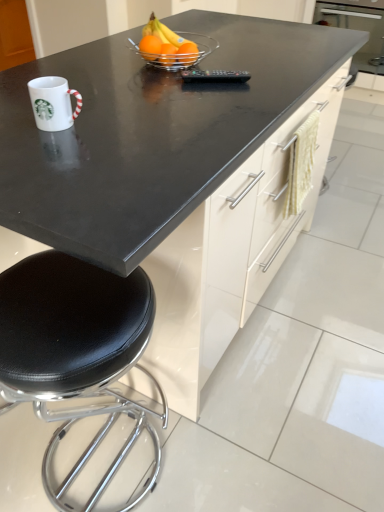
Question: Can you confirm if black glossy countertop at center is positioned to the left of orange matte at center, acting as the third orange starting from the left?

Choices:
 (A) no
 (B) yes

Answer: (B)

Question: Is black glossy countertop at center shorter than orange matte at center, positioned as the 1th orange in right-to-left order?

Choices:
 (A) no
 (B) yes

Answer: (A)

Question: Is black glossy countertop at center oriented away from orange matte at center, positioned as the 1th orange in right-to-left order?

Choices:
 (A) no
 (B) yes

Answer: (A)

Question: Does black glossy countertop at center contain orange matte at center, positioned as the 1th orange in right-to-left order?

Choices:
 (A) yes
 (B) no

Answer: (B)

Question: Is black glossy countertop at center smaller than orange matte at center, positioned as the 1th orange in right-to-left order?

Choices:
 (A) yes
 (B) no

Answer: (B)

Question: Based on their positions, is translucent glass bowl at center located to the left or right of white glossy mug at left?

Choices:
 (A) right
 (B) left

Answer: (A)

Question: From the image's perspective, relative to white glossy mug at left, is translucent glass bowl at center above or below?

Choices:
 (A) above
 (B) below

Answer: (A)

Question: In terms of width, does translucent glass bowl at center look wider or thinner when compared to white glossy mug at left?

Choices:
 (A) thin
 (B) wide

Answer: (B)

Question: Is point (178, 68) positioned closer to the camera than point (62, 129)?

Choices:
 (A) closer
 (B) farther

Answer: (B)

Question: Considering the relative positions of translucent glass bowl at center and black glossy countertop at center in the image provided, is translucent glass bowl at center to the left or to the right of black glossy countertop at center?

Choices:
 (A) right
 (B) left

Answer: (B)

Question: In the image, is translucent glass bowl at center positioned in front of or behind black glossy countertop at center?

Choices:
 (A) behind
 (B) front

Answer: (A)

Question: Considering the positions of point (150, 53) and point (122, 265), is point (150, 53) closer or farther from the camera than point (122, 265)?

Choices:
 (A) farther
 (B) closer

Answer: (A)

Question: Is translucent glass bowl at center wider or thinner than black glossy countertop at center?

Choices:
 (A) thin
 (B) wide

Answer: (A)

Question: From a real-world perspective, relative to orange matte at center, positioned as the 1th orange in right-to-left order, is translucent glass bowl at center vertically above or below?

Choices:
 (A) above
 (B) below

Answer: (A)

Question: Is translucent glass bowl at center taller or shorter than orange matte at center, positioned as the 1th orange in right-to-left order?

Choices:
 (A) short
 (B) tall

Answer: (B)